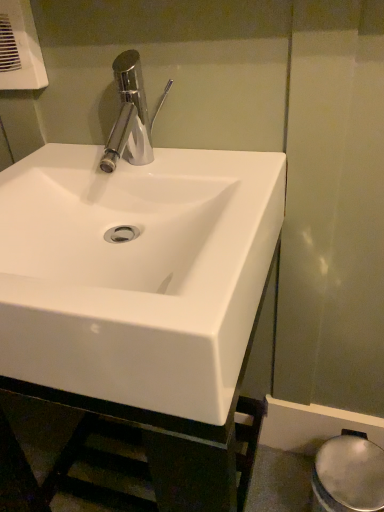
Question: From their relative heights in the image, would you say white plastic hand dryer at upper left is taller or shorter than white glossy sink at center?

Choices:
 (A) short
 (B) tall

Answer: (A)

Question: Is white plastic hand dryer at upper left situated inside white glossy sink at center or outside?

Choices:
 (A) outside
 (B) inside

Answer: (A)

Question: Which object is positioned farthest from the white plastic hand dryer at upper left?

Choices:
 (A) white glossy bidet at lower right
 (B) white glossy sink at center

Answer: (A)

Question: Based on their relative distances, which object is nearer to the white plastic hand dryer at upper left?

Choices:
 (A) white glossy sink at center
 (B) white glossy bidet at lower right

Answer: (A)